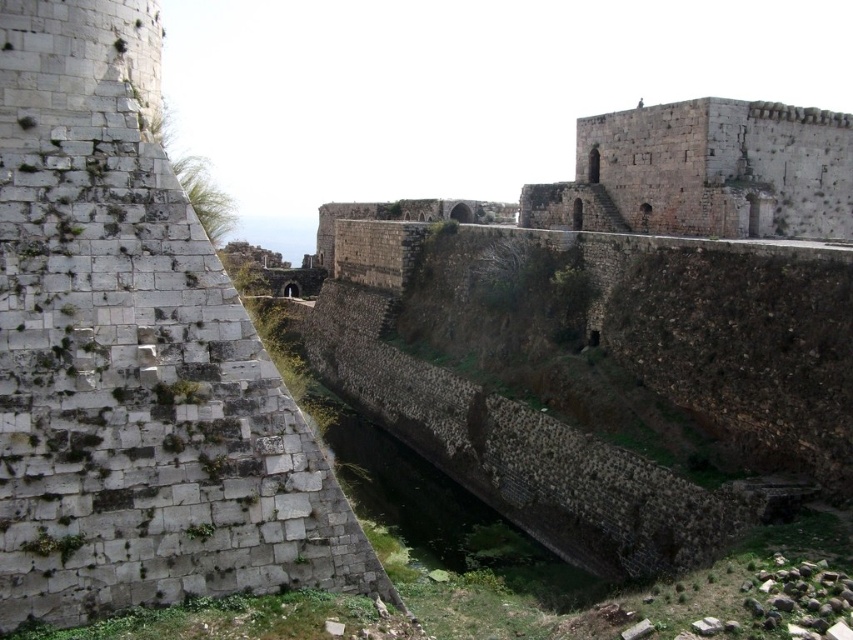
You are a castle architect examining the fortress. You need to place a new decorative statue between the white stone wall at left and the gray stone tower at center. Based on their positions, which object should the statue be closer to?

The statue should be placed closer to the gray stone tower at center because the white stone wall at left is positioned to the left of the gray stone tower at center, meaning the tower is closer to the center and the statue can be placed between them accordingly.

You are a castle architect examining the structure. Which of the two objects, the white stone wall at left or the gray stone tower at center, has a smaller thickness? Please base your answer on the structural details provided.

The white stone wall at left is thinner than the gray stone tower at center, so the white stone wall at left has a smaller thickness.

You are standing at the center of the fortress and looking towards the moat. Where is the white stone wall at left located in relation to your position?

The white stone wall at left is located at the left side of the fortress, positioned at coordinates approximately 0.558 on the x axis and 0.158 on the y axis relative to your current position.